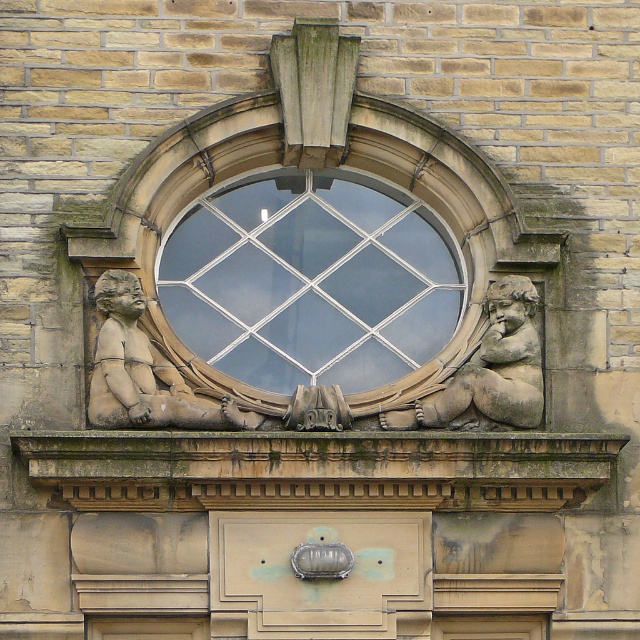
Consider the image. You are an architect analyzing the facade of this building. You observe two points marked on the image at coordinates point (248, 368) and point (154, 356). Which of these points is closer to the viewer?

Point (154, 356) is closer to the viewer because it is in front of point (248, 368).

You are an architect examining the building facade. You need to determine which object, the clear glass window at center or the stone cherub at center, has a smaller width. Based on the description, which one is narrower?

The clear glass window at center is thinner than the stone cherub at center, so the clear glass window at center has a smaller width.

You are an architect reviewing a building facade. You notice a point at coordinates (308, 282). Based on the scene description, what object is located at this point?

The point at coordinates (308, 282) indicates the clear glass window at center.